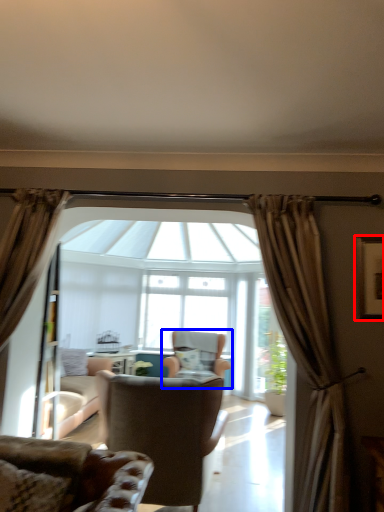
Question: Which of the following is the closest to the observer, picture frame (highlighted by a red box) or chair (highlighted by a blue box)?

Choices:
 (A) picture frame
 (B) chair

Answer: (A)